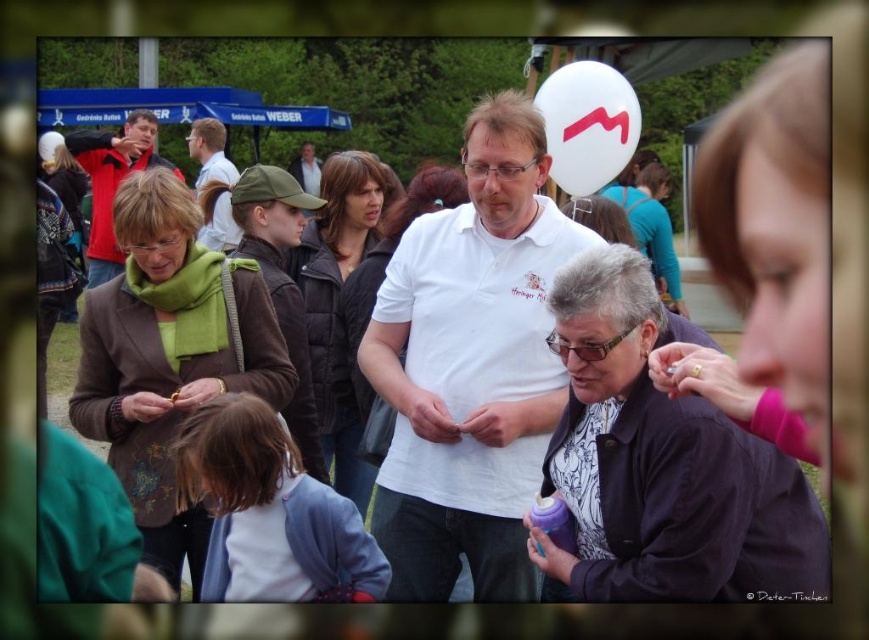
Question: Estimate the real-world distances between objects in this image. Which object is closer to the brown quilted jacket at center?

Choices:
 (A) matte white shirt at center
 (B) white cotton shirt at center
 (C) matte green scarf at left
 (D) matte brown jacket at upper left

Answer: (B)

Question: Which of the following is the closest to the observer?

Choices:
 (A) pyautogui.click(x=356, y=202)
 (B) pyautogui.click(x=625, y=289)

Answer: (B)

Question: Does matte green scarf at left appear under brown quilted jacket at center?

Choices:
 (A) yes
 (B) no

Answer: (A)

Question: Which point is closer to the camera taking this photo?

Choices:
 (A) tap(249, 284)
 (B) tap(289, 168)

Answer: (A)

Question: Does white matte shirt at center appear on the left side of matte black jacket at center?

Choices:
 (A) no
 (B) yes

Answer: (A)

Question: Can you confirm if white cotton shirt at center is thinner than matte white shirt at center?

Choices:
 (A) no
 (B) yes

Answer: (A)